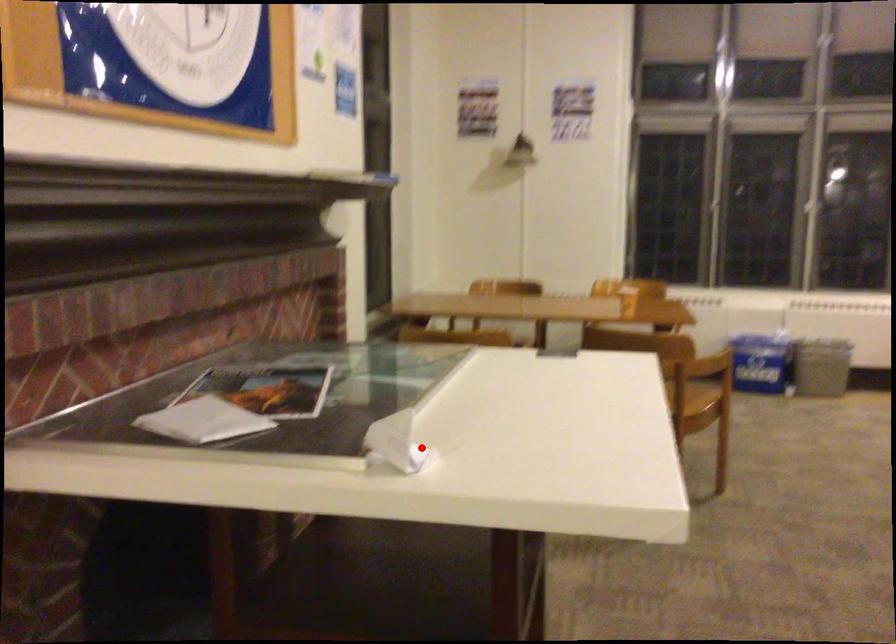
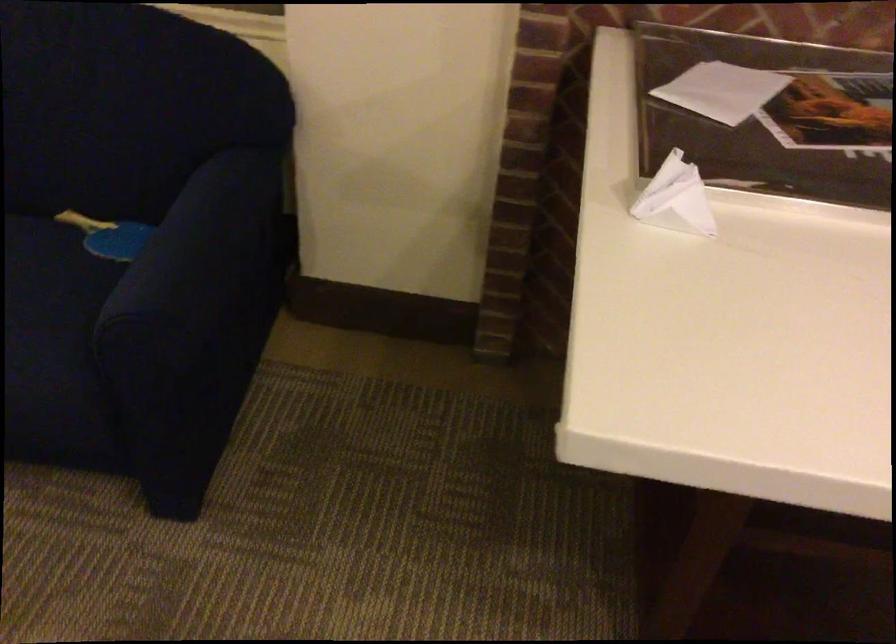
Question: I am providing you with two images of the same scene from different viewpoints. Given a red point in image1, look at the same physical point in image2. Is it:

Choices:
 (A) Closer to the viewpoint
 (B) Farther from the viewpoint

Answer: (A)